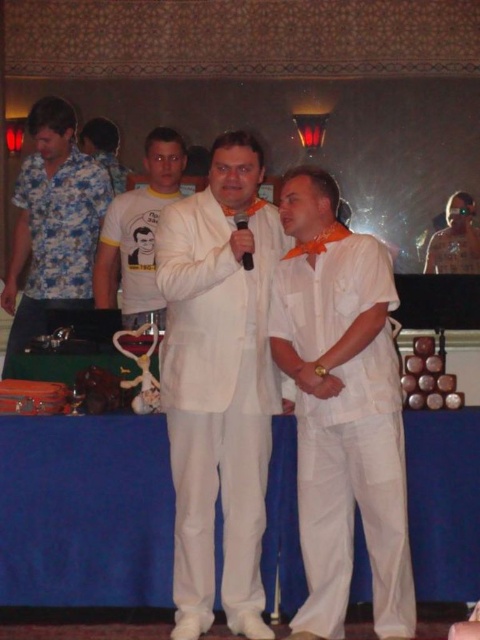
You are an event planner trying to arrange seating for the attendees. You notice two points marked on the stage floor plan. The first point is at coordinate point(x=307, y=436) and the second is at point(x=238, y=228). Based on the stage setup described, which point is closer to the audience? Please answer with the coordinate point.

Point(x=307, y=436) is in front of point(x=238, y=228), so it is closer to the audience.

You are standing in the audience and want to locate the white satin shirt at center. Based on the coordinates provided, where should you look relative to the stage?

The white satin shirt at center is located at coordinates point 0.639 on the x axis and 0.713 on the y axis, so you should look towards the central area of the stage slightly to the right and lower center.